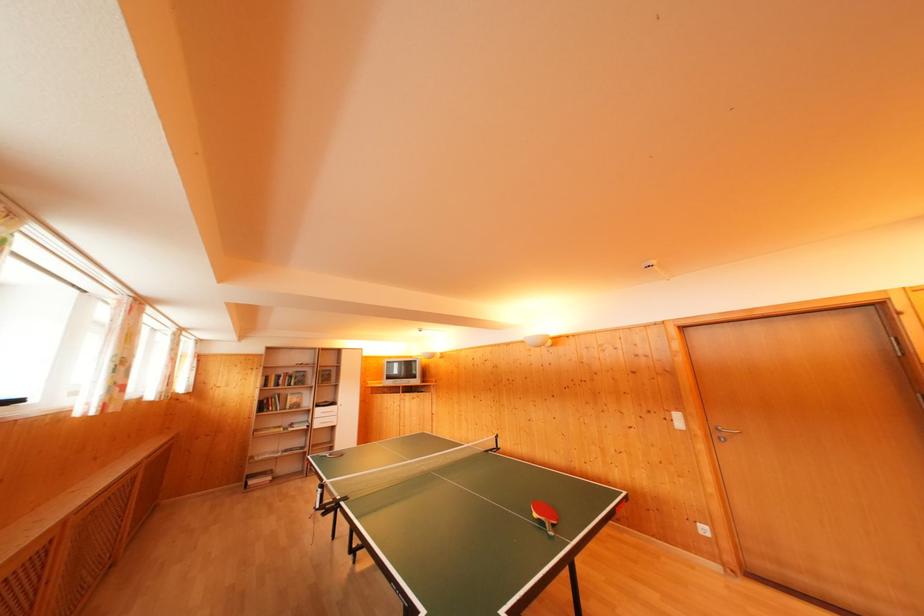
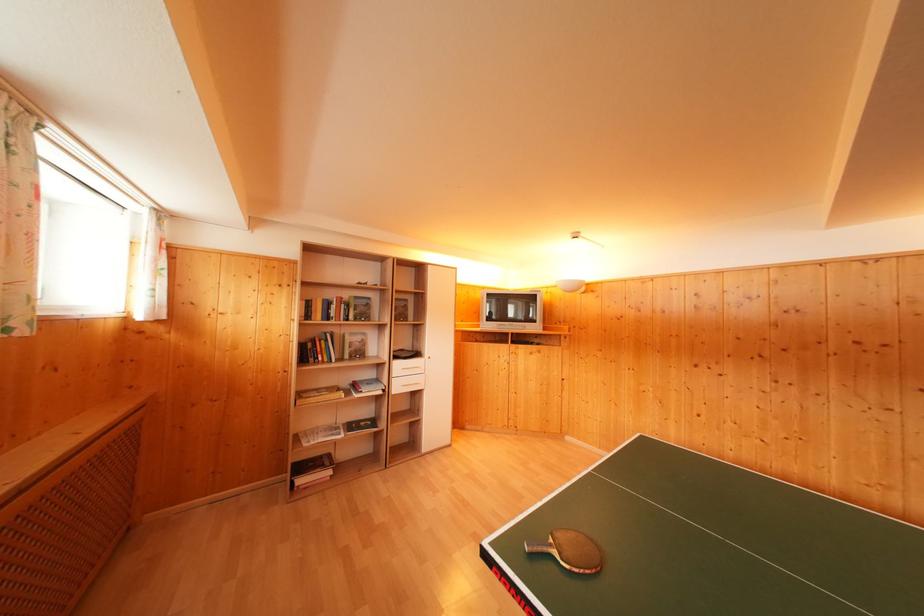
Locate, in the second image, the point that corresponds to (308,424) in the first image.

(375, 379)